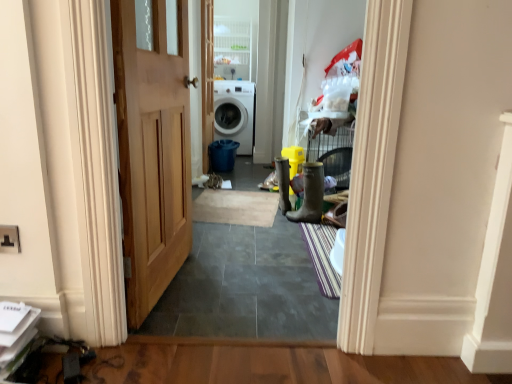
What is the approximate height of rubber boot at center, the first boot in the back-to-front sequence?

rubber boot at center, the first boot in the back-to-front sequence, is 15.69 inches tall.

Measure the distance between white plastic cabinet at upper center and camera.

The distance of white plastic cabinet at upper center from camera is 4.69 meters.

Where is `rubber boot at center, the 2th boot from the right`? This screenshot has width=512, height=384. rubber boot at center, the 2th boot from the right is located at coordinates (283, 183).

Identify the location of doormat behind the striped fabric doormat at center, marked as the 1th doormat in a right-to-left arrangement. The image size is (512, 384). tap(236, 207).

Between striped fabric doormat at center, placed as the 2th doormat when sorted from left to right, and beige carpet at center, acting as the 1th doormat starting from the back, which one has less height?

beige carpet at center, acting as the 1th doormat starting from the back, is shorter.

Which object is more forward, striped fabric doormat at center, placed as the 2th doormat when sorted from left to right, or beige carpet at center, positioned as the 1th doormat in left-to-right order?

striped fabric doormat at center, placed as the 2th doormat when sorted from left to right, is closer to the camera.

From the picture: Measure the distance from rubber boot at center, which appears as the 2th boot when viewed from the front, to white glossy washing machine at center.

rubber boot at center, which appears as the 2th boot when viewed from the front, is 5.76 feet from white glossy washing machine at center.

From the image's perspective, is rubber boot at center, the 2th boot from the right, on white glossy washing machine at center?

No, from the image's perspective, rubber boot at center, the 2th boot from the right, is not over white glossy washing machine at center.

Is rubber boot at center, placed as the 1th boot when sorted from left to right, shorter than white glossy washing machine at center?

Correct, rubber boot at center, placed as the 1th boot when sorted from left to right, is not as tall as white glossy washing machine at center.

Is rubber boot at center, which appears as the 2th boot when viewed from the front, placed right next to white glossy washing machine at center?

rubber boot at center, which appears as the 2th boot when viewed from the front, is not next to white glossy washing machine at center, and they're not touching.

From a real-world perspective, is rubber/matte boot at right, which is the first boot from front to back, positioned under beige carpet at center, which is the 2th doormat in front-to-back order, based on gravity?

No, from a real-world perspective, rubber/matte boot at right, which is the first boot from front to back, is not beneath beige carpet at center, which is the 2th doormat in front-to-back order.

Is beige carpet at center, the second doormat positioned from the bottom, at the back of rubber/matte boot at right, placed as the second boot when sorted from left to right?

No, rubber/matte boot at right, placed as the second boot when sorted from left to right, is not facing away from beige carpet at center, the second doormat positioned from the bottom.

Can you tell me how much rubber/matte boot at right, which is the first boot from front to back, and beige carpet at center, acting as the 1th doormat starting from the back, differ in facing direction?

rubber/matte boot at right, which is the first boot from front to back, and beige carpet at center, acting as the 1th doormat starting from the back, are facing 171 degrees away from each other.

At what (x,y) coordinates should I click in order to perform the action: click on doormat that is the 1st object located below the rubber/matte boot at right, placed as the second boot when sorted from left to right (from the image's perspective). Please return your answer as a coordinate pair (x, y). The width and height of the screenshot is (512, 384). Looking at the image, I should click on (236, 207).

Is beige carpet at center, which is the 2th doormat in front-to-back order, oriented away from white plastic cabinet at upper center?

No, beige carpet at center, which is the 2th doormat in front-to-back order, is not facing the opposite direction of white plastic cabinet at upper center.

Can you confirm if beige carpet at center, acting as the 1th doormat starting from the back, is wider than white plastic cabinet at upper center?

Indeed, beige carpet at center, acting as the 1th doormat starting from the back, has a greater width compared to white plastic cabinet at upper center.

From the image's perspective, is beige carpet at center, the second doormat in the right-to-left sequence, over white plastic cabinet at upper center?

Incorrect, from the image's perspective, beige carpet at center, the second doormat in the right-to-left sequence, is lower than white plastic cabinet at upper center.

At what (x,y) coordinates should I click in order to perform the action: click on cabinetry that appears on the left of beige carpet at center, acting as the 1th doormat starting from the back. Please return your answer as a coordinate pair (x, y). This screenshot has height=384, width=512. Looking at the image, I should click on (232, 49).

Considering the sizes of objects wooden door at left and rubber/matte boot at right, placed as the second boot when sorted from left to right, in the image provided, who is wider, wooden door at left or rubber/matte boot at right, placed as the second boot when sorted from left to right,?

With larger width is rubber/matte boot at right, placed as the second boot when sorted from left to right.

Is wooden door at left shorter than rubber/matte boot at right, which is counted as the second boot, starting from the back?

No.

Considering the relative sizes of wooden door at left and rubber/matte boot at right, the first boot when ordered from right to left, in the image provided, is wooden door at left bigger than rubber/matte boot at right, the first boot when ordered from right to left,?

Yes, wooden door at left is bigger than rubber/matte boot at right, the first boot when ordered from right to left.

Is wooden door at left positioned beyond the bounds of rubber/matte boot at right, the first boot when ordered from right to left?

Yes, wooden door at left is not within rubber/matte boot at right, the first boot when ordered from right to left.

Could you tell me if rubber/matte boot at right, the first boot when ordered from right to left, is turned towards white plastic cabinet at upper center?

No.

Which object is positioned more to the right, rubber/matte boot at right, which is the first boot from front to back, or white plastic cabinet at upper center?

Positioned to the right is rubber/matte boot at right, which is the first boot from front to back.

What's the angular difference between rubber/matte boot at right, placed as the second boot when sorted from left to right, and white plastic cabinet at upper center's facing directions?

There is a 106-degree angle between the facing directions of rubber/matte boot at right, placed as the second boot when sorted from left to right, and white plastic cabinet at upper center.

Considering their positions, is rubber/matte boot at right, placed as the second boot when sorted from left to right, located in front of or behind white plastic cabinet at upper center?

Visually, rubber/matte boot at right, placed as the second boot when sorted from left to right, is located in front of white plastic cabinet at upper center.

Can you confirm if striped fabric doormat at center, placed as the 2th doormat when sorted from left to right, is smaller than white plastic cabinet at upper center?

Yes.

I want to click on cabinetry located above the striped fabric doormat at center, marked as the 1th doormat in a right-to-left arrangement (from the image's perspective), so click(x=232, y=49).

From the image's perspective, would you say striped fabric doormat at center, the 2th doormat in the top-to-bottom sequence, is shown under white plastic cabinet at upper center?

Yes, from the image's perspective, striped fabric doormat at center, the 2th doormat in the top-to-bottom sequence, is below white plastic cabinet at upper center.

Is the surface of striped fabric doormat at center, marked as the 1th doormat in a right-to-left arrangement, in direct contact with white plastic cabinet at upper center?

No, striped fabric doormat at center, marked as the 1th doormat in a right-to-left arrangement, is not touching white plastic cabinet at upper center.

At what (x,y) coordinates should I click in order to perform the action: click on doormat located above the striped fabric doormat at center, the 2th doormat in the top-to-bottom sequence (from the image's perspective). Please return your answer as a coordinate pair (x, y). Looking at the image, I should click on (236, 207).

Which boot is the 1st one when counting from the front of the white glossy washing machine at center? Please provide its 2D coordinates.

[(283, 183)]

Which object lies nearer to the anchor point beige carpet at center, marked as the first doormat in a top-to-bottom arrangement, rubber boot at center, the 2th boot from the right, or rubber/matte boot at right, placed as the second boot when sorted from left to right?

rubber boot at center, the 2th boot from the right, is positioned closer to the anchor beige carpet at center, marked as the first doormat in a top-to-bottom arrangement.

Which object lies further to the anchor point rubber/matte boot at right, the first boot when ordered from right to left, white glossy washing machine at center or rubber boot at center, the 2th boot from the right?

Based on the image, white glossy washing machine at center appears to be further to rubber/matte boot at right, the first boot when ordered from right to left.

Based on their spatial positions, is rubber boot at center, the first boot in the back-to-front sequence, or beige carpet at center, positioned as the 1th doormat in left-to-right order, closer to striped fabric doormat at center, marked as the 1th doormat in a right-to-left arrangement?

rubber boot at center, the first boot in the back-to-front sequence, is positioned closer to the anchor striped fabric doormat at center, marked as the 1th doormat in a right-to-left arrangement.

Based on the photo, looking at the image, which one is located closer to beige carpet at center, which is the 2th doormat in front-to-back order, striped fabric doormat at center, placed as the 1th doormat when sorted from bottom to top, or wooden door at left?

The object closer to beige carpet at center, which is the 2th doormat in front-to-back order, is striped fabric doormat at center, placed as the 1th doormat when sorted from bottom to top.

Considering their positions, is wooden door at left positioned further to white glossy washing machine at center than rubber/matte boot at right, placed as the second boot when sorted from left to right?

Among the two, wooden door at left is located further to white glossy washing machine at center.

Looking at the image, which one is located closer to striped fabric doormat at center, which is counted as the 2th doormat, starting from the back, rubber boot at center, the first boot in the back-to-front sequence, or rubber/matte boot at right, placed as the second boot when sorted from left to right?

rubber/matte boot at right, placed as the second boot when sorted from left to right.

Which object lies further to the anchor point wooden door at left, rubber boot at center, the first boot in the back-to-front sequence, or white glossy washing machine at center?

The object further to wooden door at left is white glossy washing machine at center.

Which object lies nearer to the anchor point rubber/matte boot at right, placed as the second boot when sorted from left to right, beige carpet at center, which is the 2th doormat in front-to-back order, or wooden door at left?

beige carpet at center, which is the 2th doormat in front-to-back order, is closer to rubber/matte boot at right, placed as the second boot when sorted from left to right.

The image size is (512, 384). What are the coordinates of `doormat between striped fabric doormat at center, which is counted as the 2th doormat, starting from the back, and white plastic cabinet at upper center from front to back` in the screenshot? It's located at (236, 207).

The height and width of the screenshot is (384, 512). I want to click on cabinetry between beige carpet at center, positioned as the 1th doormat in left-to-right order, and white glossy washing machine at center from front to back, so click(x=232, y=49).

At what (x,y) coordinates should I click in order to perform the action: click on cabinetry between wooden door at left and white glossy washing machine at center along the z-axis. Please return your answer as a coordinate pair (x, y). The height and width of the screenshot is (384, 512). Looking at the image, I should click on (232, 49).

Identify the location of doormat between rubber/matte boot at right, placed as the second boot when sorted from left to right, and white plastic cabinet at upper center from front to back. (236, 207).